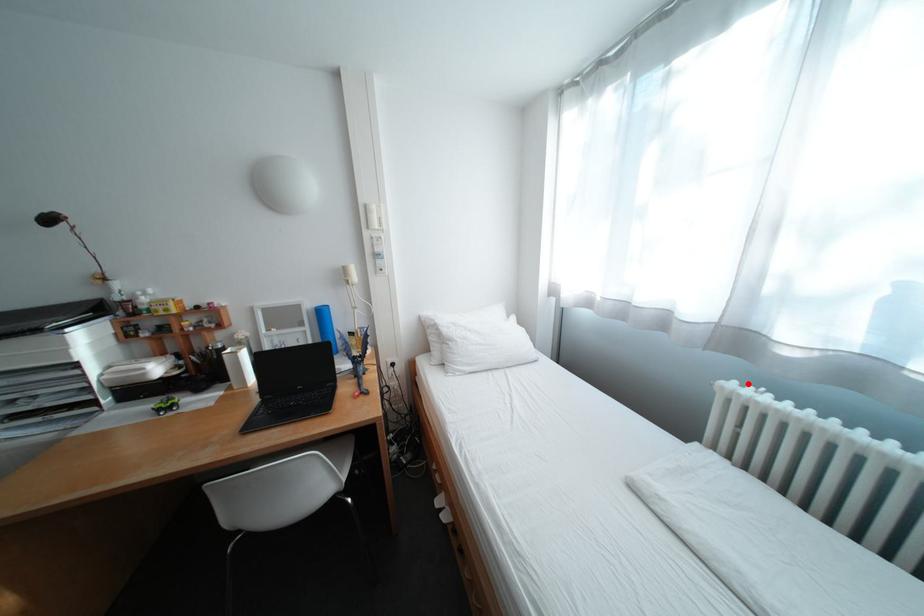
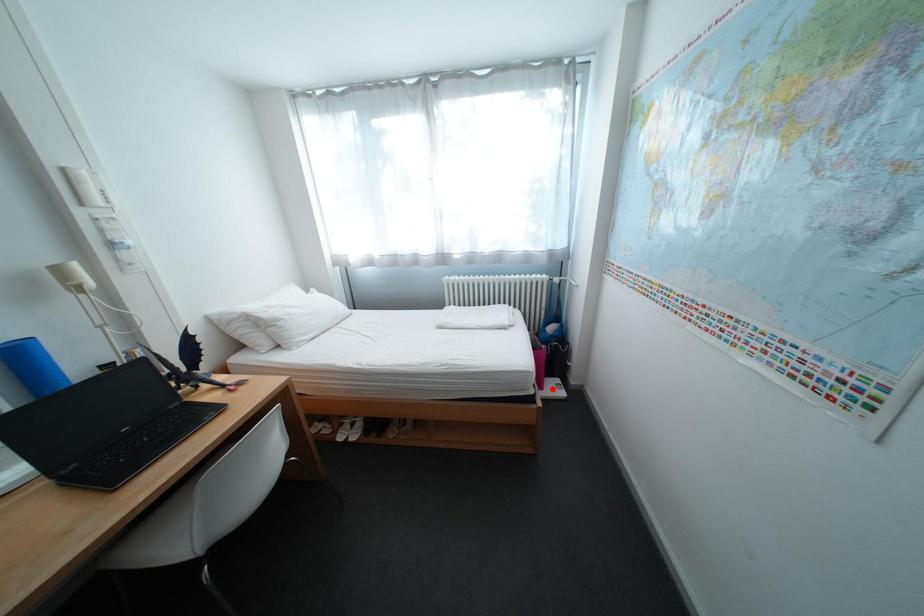
I am providing you with two images of the same scene from different viewpoints. A red point is marked on the first image and another point is marked on the second image. Is the marked point in image1 the same physical position as the marked point in image2?

No